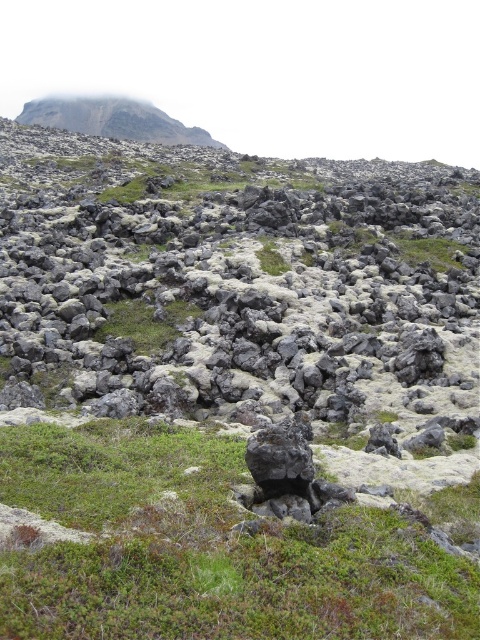
Between rugged stone hillside at upper left and green grassy at center, which one appears on the left side from the viewer's perspective?

rugged stone hillside at upper left

Between rugged stone hillside at upper left and green grassy at center, which one is positioned lower?

green grassy at center is lower down.

Describe the element at coordinates (113, 120) in the screenshot. I see `rugged stone hillside at upper left` at that location.

Locate an element on the screen. Image resolution: width=480 pixels, height=640 pixels. rugged stone hillside at upper left is located at coordinates (113, 120).